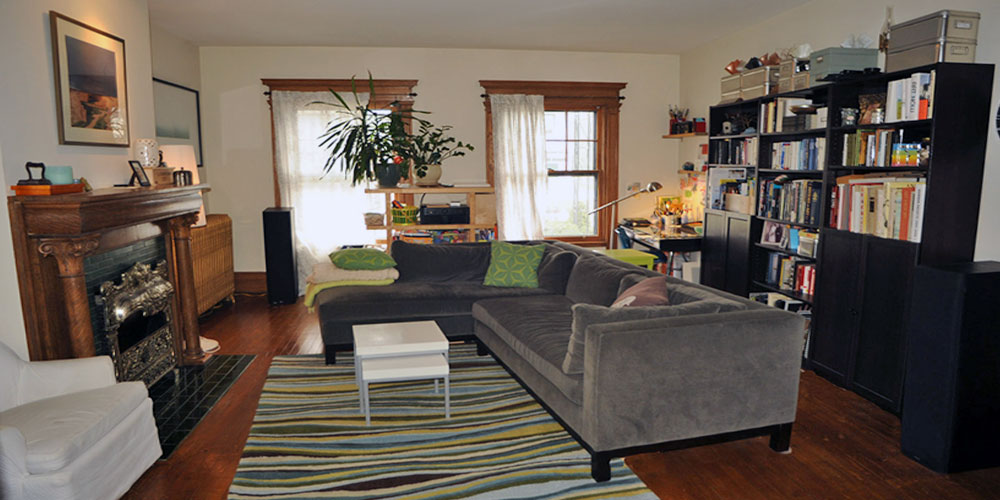
Where is `brown pillow`? This screenshot has height=500, width=1000. brown pillow is located at coordinates (648, 291).